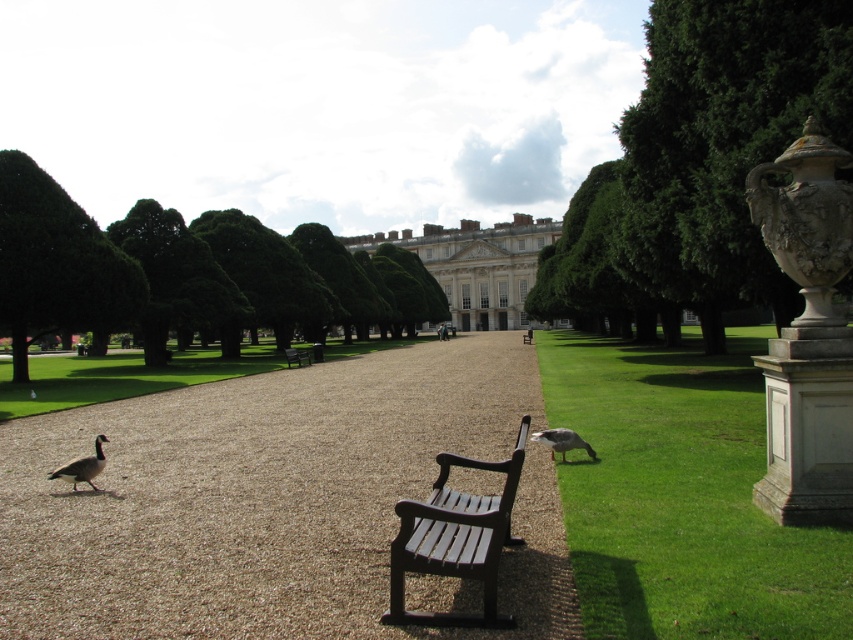
You are standing at the entrance of the park and see the point marked at coordinate (55, 262). What object is located at that point?

The point at coordinate (55, 262) corresponds to the green leafy tree at upper left.